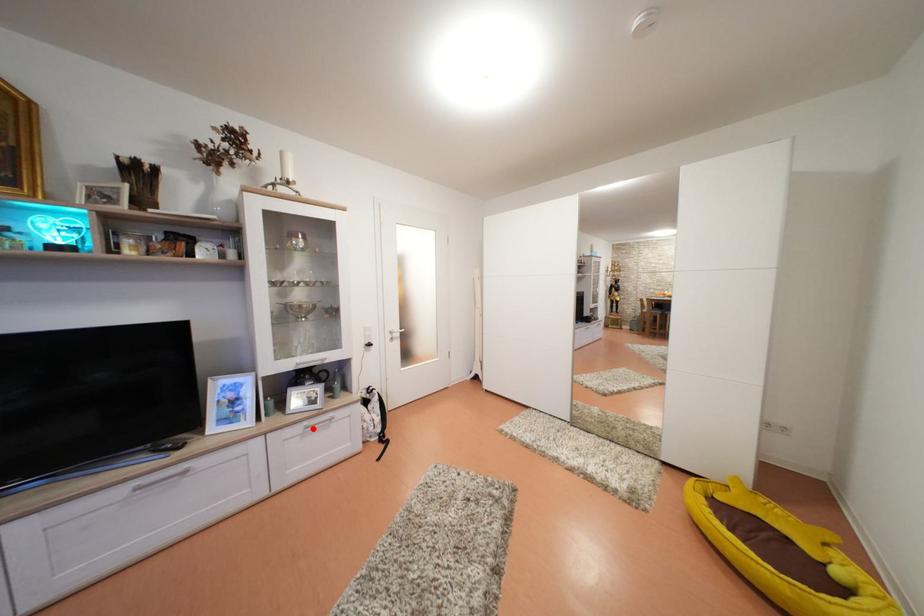
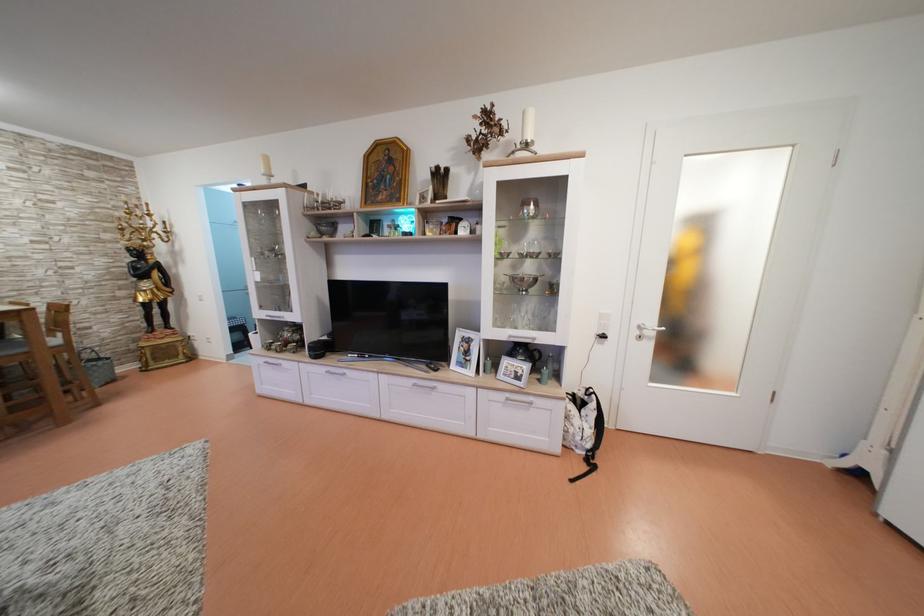
Question: I am providing you with two images of the same scene from different viewpoints. Image1 has a red point marked. In image2, the corresponding 3D location appears at what relative position? Reply with the corresponding letter.

Choices:
 (A) Closer
 (B) Farther

Answer: (B)